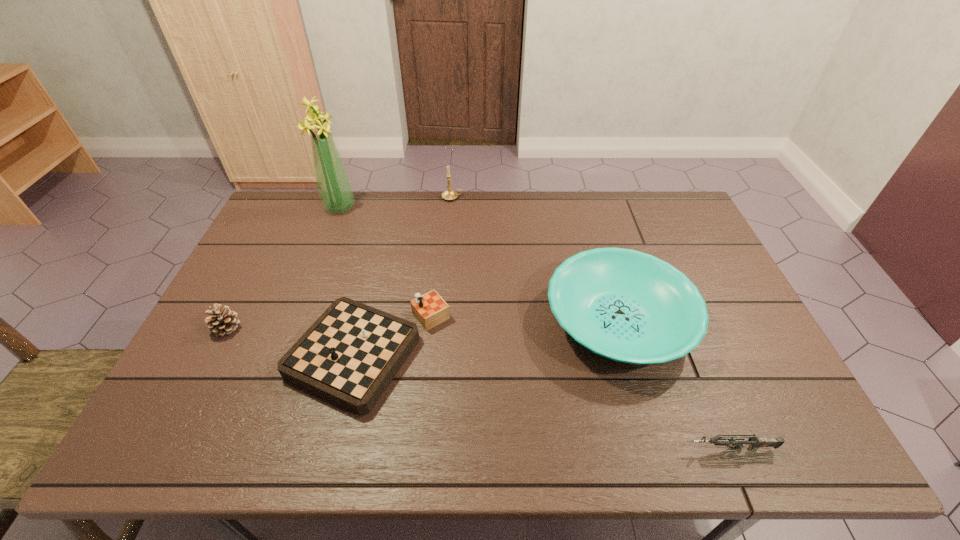
Identify the location of free space that satisfies the following two spatial constraints: 1. on the back side of the dish; 2. on the handle side of the candle holder. (584, 198).

Find the location of a particular element. This screenshot has height=540, width=960. vacant position in the image that satisfies the following two spatial constraints: 1. on the front-facing side of the tallest object; 2. on the back side of the dish is located at coordinates (297, 321).

The image size is (960, 540). I want to click on vacant region that satisfies the following two spatial constraints: 1. on the front-facing side of the bouquet; 2. on the left side of the chessboard, so click(285, 353).

Locate an element on the screen. This screenshot has height=540, width=960. free point that satisfies the following two spatial constraints: 1. on the front-facing side of the bouquet; 2. on the back side of the dish is located at coordinates (297, 321).